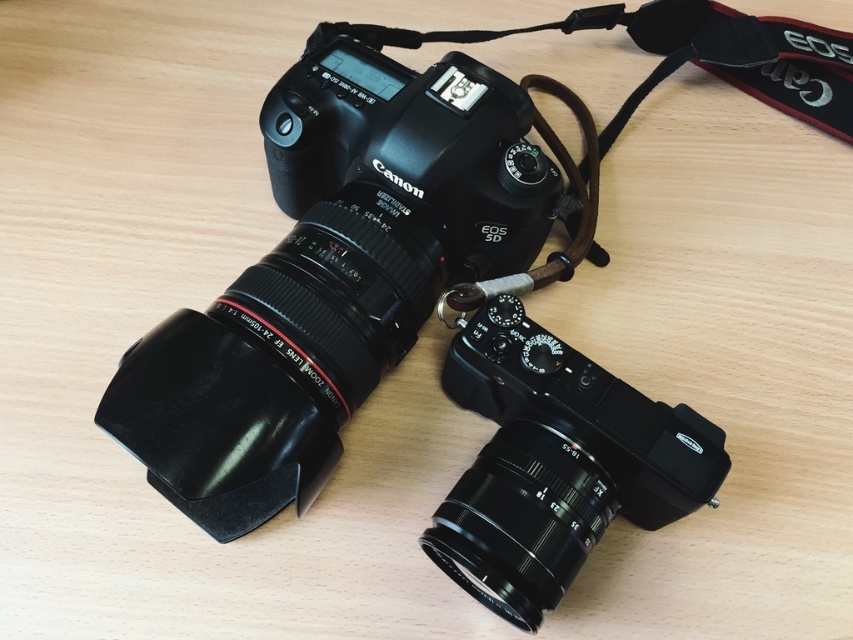
You are a photographer setting up equipment for a photoshoot. You have two cameras in front of you, the matte black camera at center and the black matte camera at center. Which camera has a larger width?

The matte black camera at center has a larger width than the black matte camera at center according to the description.

You are a photographer setting up equipment. You need to adjust the focus on the matte black camera at center and the black matte lens at lower center. Which one do you need to move closer to your eye to focus properly?

The matte black camera at center is closer to the viewer than the black matte lens at lower center, so you should move the black matte lens at lower center closer to your eye to focus properly.

You are standing in front of a table with two Canon cameras. There is a point marked at coordinates point (262, 404). If you want to place a 1.5 meter long banner between you and that point, will it reach the point?

The distance between you and the point (262, 404) is 1.21 meters. Since the banner is 1.5 meters long, it will extend beyond the point, reaching it and extending 0.29 meters past.